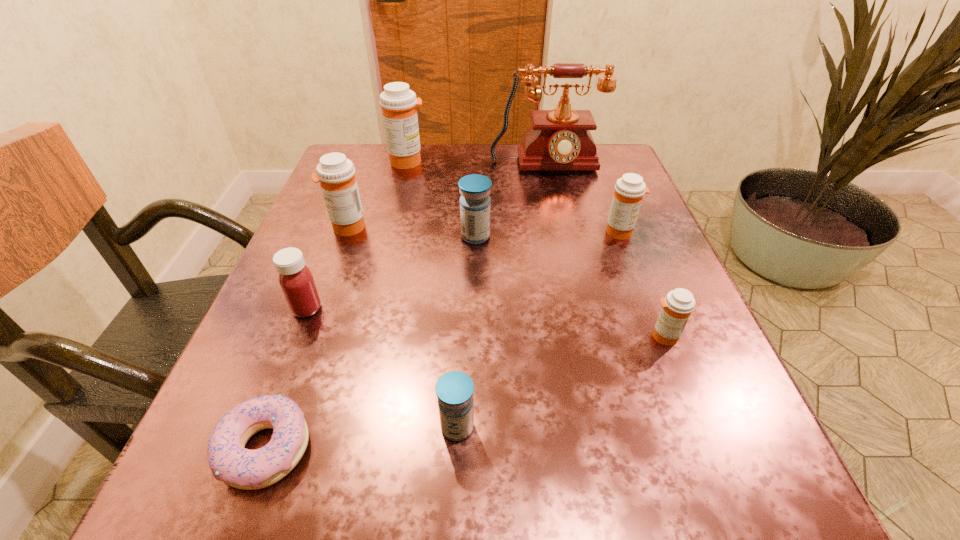
The width and height of the screenshot is (960, 540). In order to click on object that is positioned at the near left corner in this screenshot , I will do `click(229, 460)`.

Locate an element on the screen. The height and width of the screenshot is (540, 960). object present at the far right corner is located at coordinates [x=559, y=139].

Image resolution: width=960 pixels, height=540 pixels. In order to click on vacant region at the far edge of the desktop in this screenshot , I will do `click(514, 151)`.

This screenshot has width=960, height=540. I want to click on vacant space at the near edge of the desktop, so click(x=349, y=502).

In order to click on free spot at the left edge of the desktop in this screenshot , I will do `click(384, 206)`.

This screenshot has height=540, width=960. In the image, there is a desktop. Find the location of `vacant area at the right edge`. vacant area at the right edge is located at coordinates 579,236.

Find the location of `vacant space at the near left corner of the desktop`. vacant space at the near left corner of the desktop is located at coordinates (258, 504).

Where is `vacant region at the far right corner of the desktop`? This screenshot has width=960, height=540. vacant region at the far right corner of the desktop is located at coordinates (592, 180).

Locate an element on the screen. This screenshot has height=540, width=960. free spot between the telephone and the farther blue medicine is located at coordinates (511, 202).

Locate an element on the screen. The image size is (960, 540). free space between the nearer blue medicine and the doughnut is located at coordinates (361, 437).